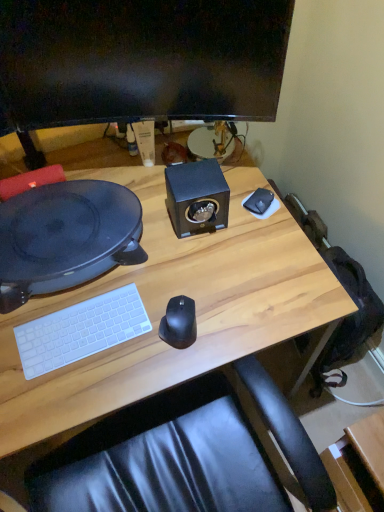
Find the location of `vacant area located to the right-hand side of black matte speaker at center`. vacant area located to the right-hand side of black matte speaker at center is located at coordinates (255, 225).